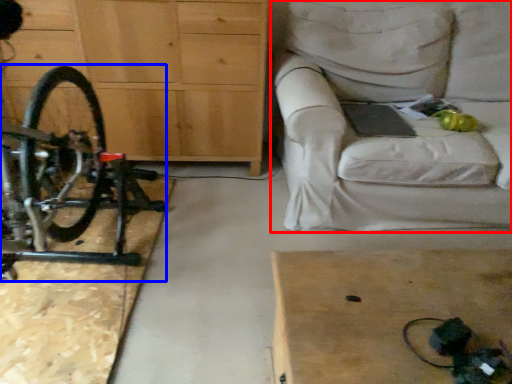
Question: Which of the following is the closest to the observer, studio couch (highlighted by a red box) or bicycle (highlighted by a blue box)?

Choices:
 (A) studio couch
 (B) bicycle

Answer: (B)